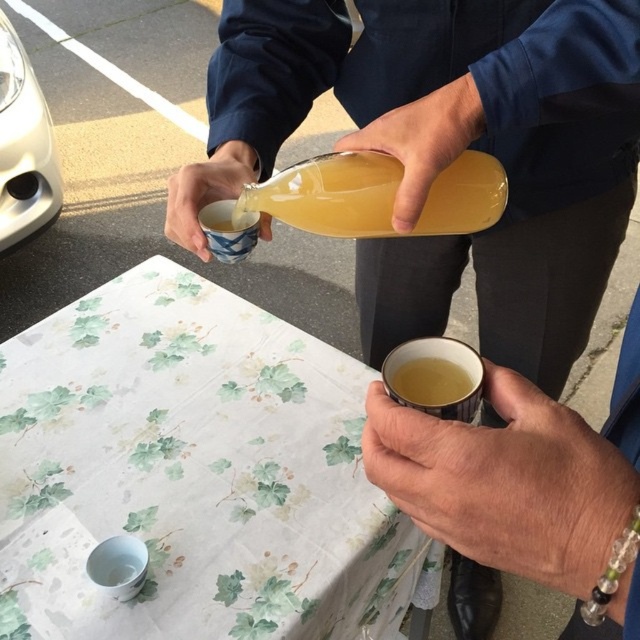
You are standing at the center of the image and want to grab the translucent glass bottle at upper center. Which direction should you move to reach it?

The translucent glass bottle at upper center is located at point 0.306 on the x axis and 0.516 on the y axis. Since you are at the center, you should move towards the upper direction to reach it.

You are a photographer trying to capture the exact moment the liquid touches the matte ceramic cup at lower center. According to the scene description, where should you focus your camera to ensure the cup is in the frame?

The matte ceramic cup at lower center is located at point coordinates of 0.756 on the x axis and 0.819 on the y axis, so you should focus your camera at that coordinate point to capture the cup in the frame.